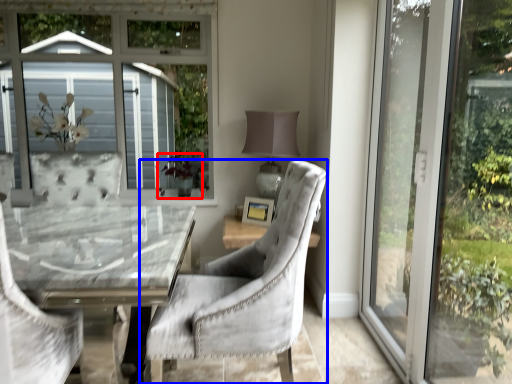
Question: Which of the following is the closest to the observer, plant (highlighted by a red box) or chair (highlighted by a blue box)?

Choices:
 (A) plant
 (B) chair

Answer: (B)